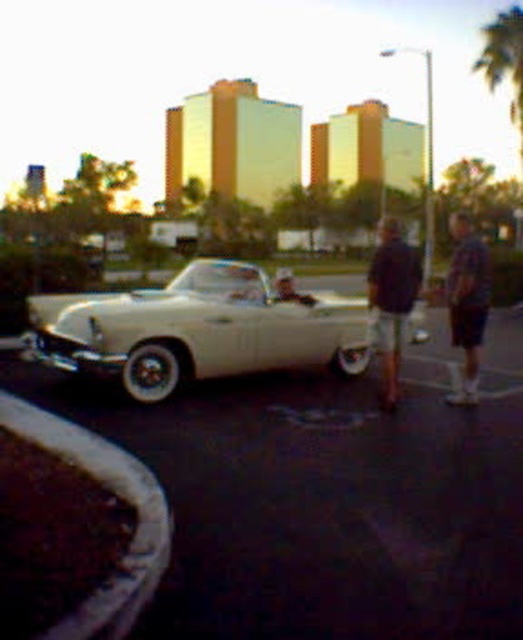
Does white glossy convertible at center have a smaller size compared to matte black car at center?

Indeed, white glossy convertible at center has a smaller size compared to matte black car at center.

Who is lower down, white glossy convertible at center or matte black car at center?

white glossy convertible at center is lower down.

Is point (321, 296) positioned behind point (288, 300)?

Yes, point (321, 296) is farther from viewer.

The image size is (523, 640). Identify the location of white glossy convertible at center. (198, 330).

Measure the distance between point (380, 243) and camera.

They are 9.49 meters apart.

Does point (380, 310) lie behind point (281, 294)?

No, (380, 310) is in front of (281, 294).

Locate an element on the screen. The height and width of the screenshot is (640, 523). dark brown shorts at center is located at coordinates (392, 300).

Which is behind, point (461, 289) or point (286, 273)?

The point (286, 273) is more distant.

Does point (460, 236) come closer to viewer compared to point (280, 280)?

Yes, it is in front of point (280, 280).

What do you see at coordinates (467, 301) in the screenshot? This screenshot has height=640, width=523. I see `blue denim shorts at right` at bounding box center [467, 301].

Identify the location of blue denim shorts at right. Image resolution: width=523 pixels, height=640 pixels. (467, 301).